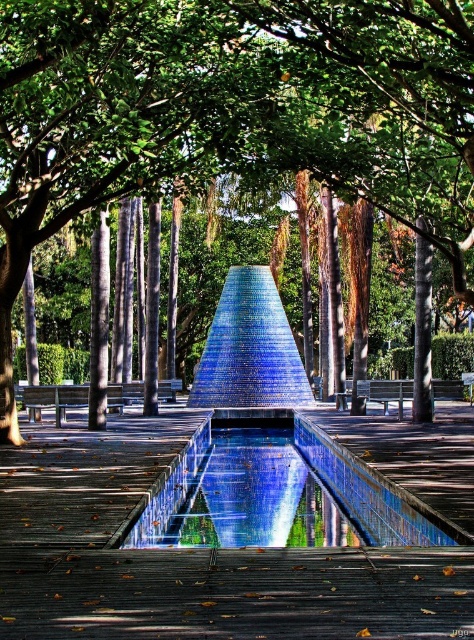
Question: Where is smooth gray pillar at center located in relation to wooden bench at center in the image?

Choices:
 (A) right
 (B) left

Answer: (A)

Question: From the image, what is the correct spatial relationship of blue mosaic pyramid at center in relation to wooden bench at center?

Choices:
 (A) above
 (B) below

Answer: (A)

Question: Is smooth gray pillar at center smaller than wooden bench at left?

Choices:
 (A) yes
 (B) no

Answer: (B)

Question: Which of these objects is positioned closest to the metallic silver bench at center?

Choices:
 (A) smooth gray pillar at center
 (B) blue mosaic fountain at center

Answer: (A)

Question: Which object is the farthest from the wooden bench at left?

Choices:
 (A) wooden bench at center
 (B) blue mosaic pool at center
 (C) blue mosaic fountain at center
 (D) blue mosaic pyramid at center

Answer: (D)

Question: Which object appears closest to the camera in this image?

Choices:
 (A) blue mosaic pool at center
 (B) wooden bench at left
 (C) blue mosaic pyramid at center
 (D) smooth gray pillar at center

Answer: (A)